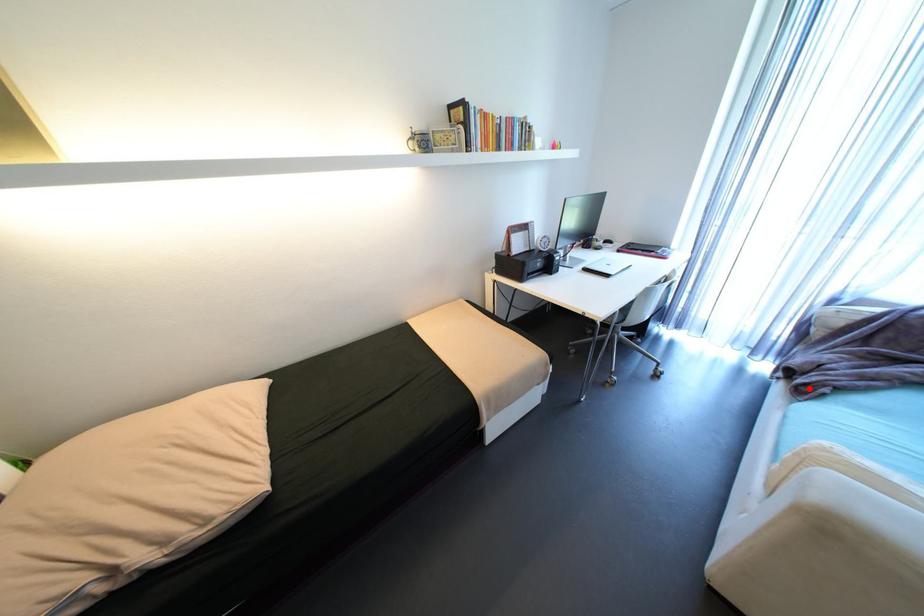
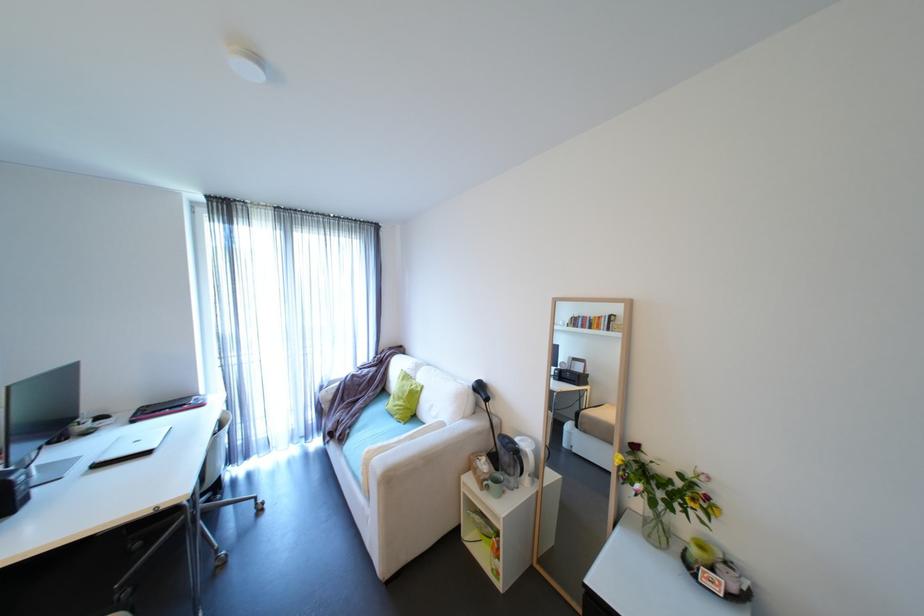
Question: I am providing you with two images of the same scene from different viewpoints. Image1 has a red point marked. In image2, the corresponding 3D location appears at what relative position? Reply with the corresponding letter.

Choices:
 (A) Closer
 (B) Farther

Answer: (B)